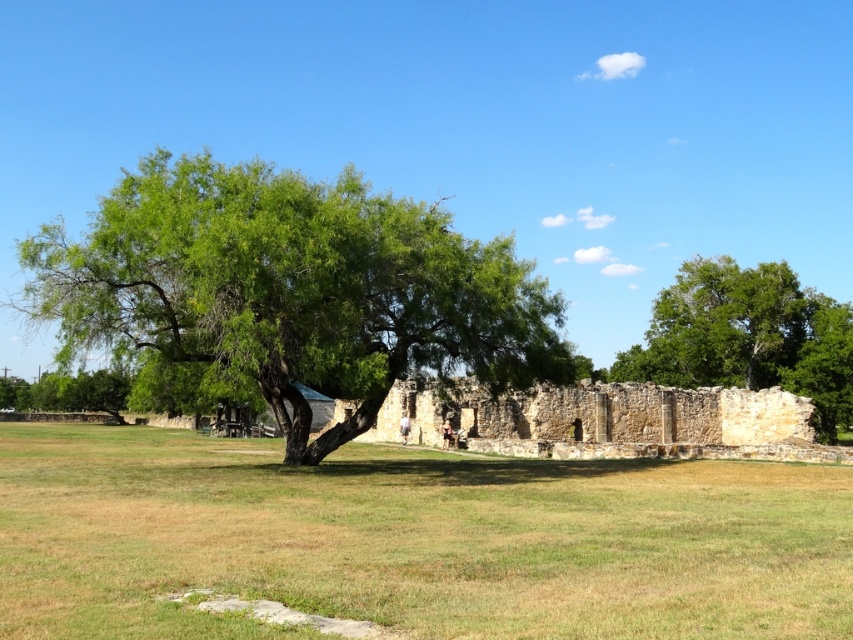
How much distance is there between stone ruins at center and green leafy tree at right?

41.36 meters

Between stone ruins at center and green leafy tree at right, which one is positioned higher?

green leafy tree at right is above.

Who is more forward, (543, 422) or (714, 266)?

Positioned in front is point (543, 422).

Identify the location of stone ruins at center. The width and height of the screenshot is (853, 640). (608, 420).

Who is higher up, green grass at center or green leafy tree at center?

green leafy tree at center is above.

Does green grass at center have a smaller size compared to green leafy tree at center?

Indeed, green grass at center has a smaller size compared to green leafy tree at center.

Between point (486, 540) and point (123, 317), which one is positioned in front?

Positioned in front is point (486, 540).

Find the location of a particular element. This screenshot has width=853, height=640. green grass at center is located at coordinates tap(412, 540).

Can you confirm if green leafy tree at center is wider than stone ruins at center?

No.

Is green leafy tree at center closer to camera compared to stone ruins at center?

Yes, it is.

This screenshot has height=640, width=853. Find the location of `green leafy tree at center`. green leafy tree at center is located at coordinates (292, 289).